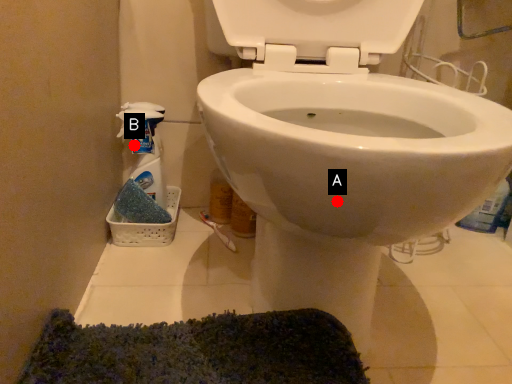
Question: Two points are circled on the image, labeled by A and B beside each circle. Which point appears farthest from the camera in this image?

Choices:
 (A) A is further
 (B) B is further

Answer: (B)